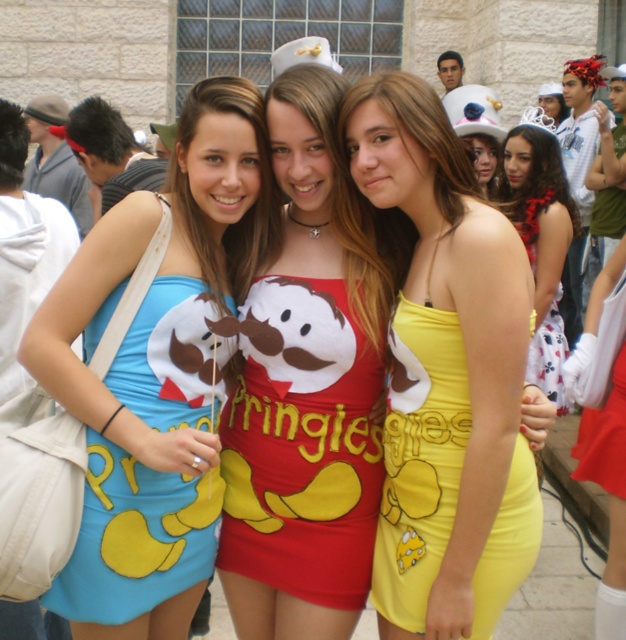
Question: Can you confirm if yellow satin dress at center is positioned below matte red dress at center?

Choices:
 (A) yes
 (B) no

Answer: (A)

Question: Which of the following is the closest to the observer?

Choices:
 (A) (555, 296)
 (B) (607, 490)

Answer: (B)

Question: Is matte blue fabric dress at left wider than yellow matte dress at center?

Choices:
 (A) yes
 (B) no

Answer: (A)

Question: Which of the following is the farthest from the observer?

Choices:
 (A) yellow satin dress at center
 (B) matte red dress at center
 (C) yellow satin dress at lower right

Answer: (C)

Question: Which object appears closest to the camera in this image?

Choices:
 (A) matte blue dress at center
 (B) yellow satin dress at center
 (C) matte blue dress at left
 (D) matte blue fabric dress at left

Answer: (B)

Question: Is yellow satin dress at lower right further to the viewer compared to floral cotton dress at right?

Choices:
 (A) no
 (B) yes

Answer: (A)